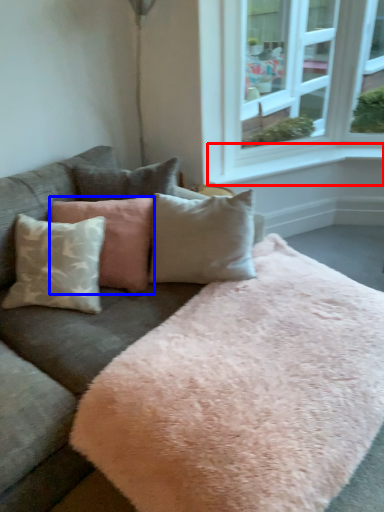
Question: Which point is closer to the camera, window sill (highlighted by a red box) or pillow (highlighted by a blue box)?

Choices:
 (A) window sill
 (B) pillow

Answer: (B)